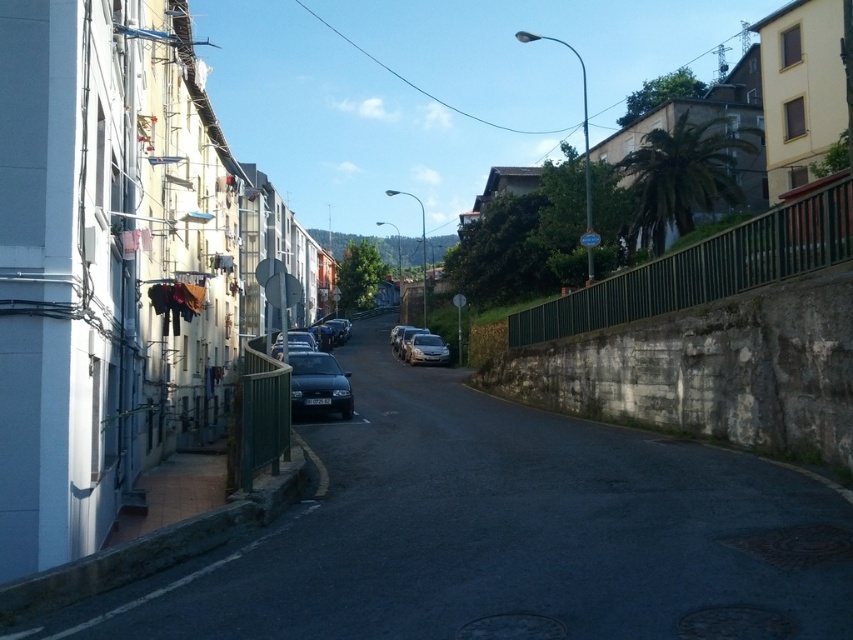
Does satin black car at center have a greater height compared to satin silver car at center?

No.

Which is behind, point (318, 368) or point (428, 337)?

The point (428, 337) is behind.

Find the location of a particular element. satin black car at center is located at coordinates (318, 385).

Identify the location of satin black car at center. The width and height of the screenshot is (853, 640). (318, 385).

Does smooth asphalt road at center have a greater height compared to satin black car at center?

No.

Between point (786, 564) and point (311, 371), which one is positioned behind?

The point (311, 371) is more distant.

Does point (332, 566) come closer to viewer compared to point (302, 397)?

Yes.

This screenshot has width=853, height=640. I want to click on smooth asphalt road at center, so click(503, 534).

Can you confirm if smooth asphalt road at center is thinner than satin silver car at center?

Incorrect, smooth asphalt road at center's width is not less than satin silver car at center's.

Image resolution: width=853 pixels, height=640 pixels. What do you see at coordinates (503, 534) in the screenshot? I see `smooth asphalt road at center` at bounding box center [503, 534].

Locate an element on the screen. Image resolution: width=853 pixels, height=640 pixels. smooth asphalt road at center is located at coordinates (503, 534).